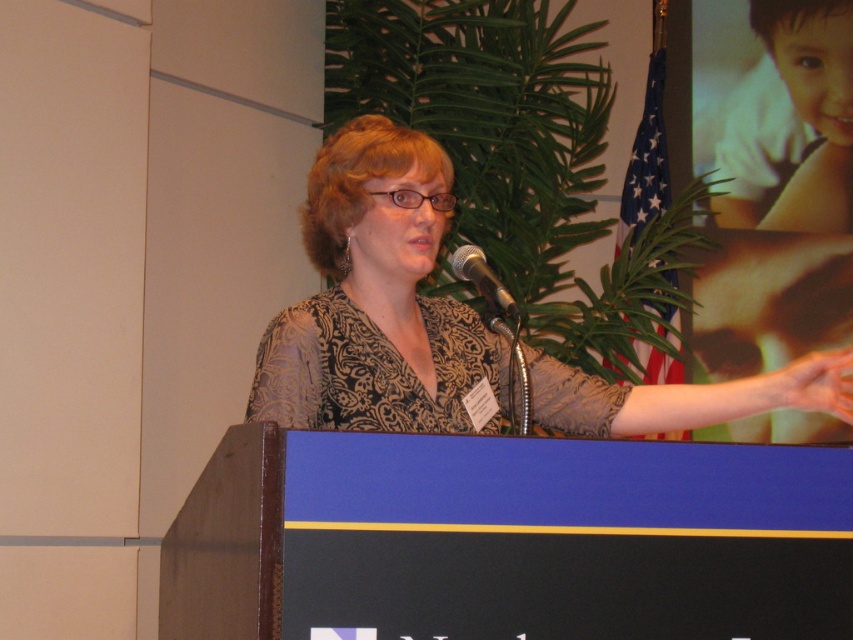
Is patterned fabric woman at center below metallic silver microphone at center?

Yes.

Describe the element at coordinates (376, 300) in the screenshot. This screenshot has width=853, height=640. I see `patterned fabric woman at center` at that location.

You are a GUI agent. You are given a task and a screenshot of the screen. Output one action in this format:
    pyautogui.click(x=<x>, y=<y>)
    Task: Click on the patterned fabric woman at center
    
    Given the screenshot: What is the action you would take?
    pyautogui.click(x=376, y=300)